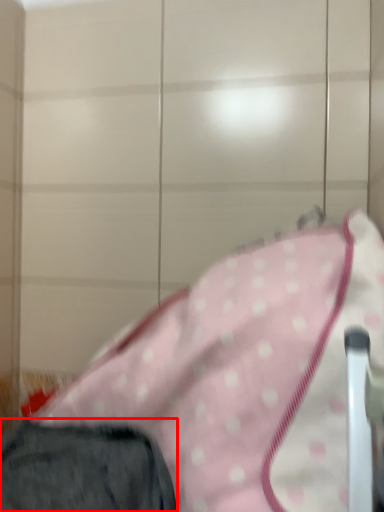
Question: From the image's perspective, considering the relative positions of trousers (annotated by the red box) and blanket in the image provided, where is trousers (annotated by the red box) located with respect to the staircase?

Choices:
 (A) above
 (B) below

Answer: (B)